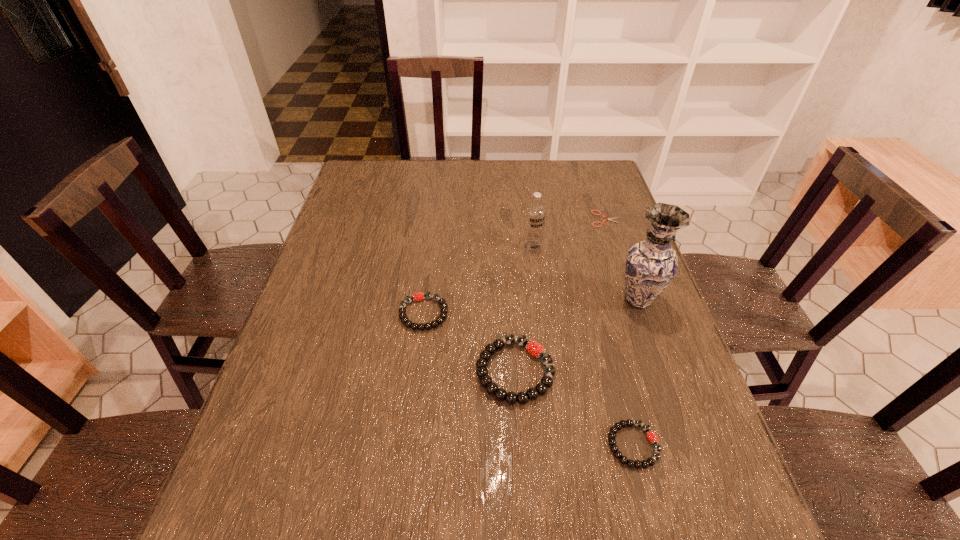
Locate an element on the screen. Image resolution: width=960 pixels, height=540 pixels. shears at the right edge is located at coordinates (609, 219).

Image resolution: width=960 pixels, height=540 pixels. What are the coordinates of `object that is at the near right corner` in the screenshot? It's located at (652, 437).

Where is `free location at the far edge`? free location at the far edge is located at coordinates (401, 173).

Locate an element on the screen. The height and width of the screenshot is (540, 960). free spot at the near edge of the desktop is located at coordinates (533, 459).

Identify the location of free space at the left edge. The image size is (960, 540). (353, 277).

You are a GUI agent. You are given a task and a screenshot of the screen. Output one action in this format:
    pyautogui.click(x=<x>, y=<y>)
    Task: Click on the vacant space at the right edge
    This screenshot has height=540, width=960.
    Given the screenshot: What is the action you would take?
    pyautogui.click(x=680, y=431)

Where is `vacant space at the far left corner of the desktop`? This screenshot has height=540, width=960. vacant space at the far left corner of the desktop is located at coordinates (392, 188).

This screenshot has width=960, height=540. In order to click on free space at the near left corner in this screenshot , I will do `click(290, 471)`.

Where is `vacant space at the near right corner`? The width and height of the screenshot is (960, 540). vacant space at the near right corner is located at coordinates (638, 452).

Locate an element on the screen. The image size is (960, 540). vacant area that lies between the shortest object and the nearest bracelet is located at coordinates (619, 332).